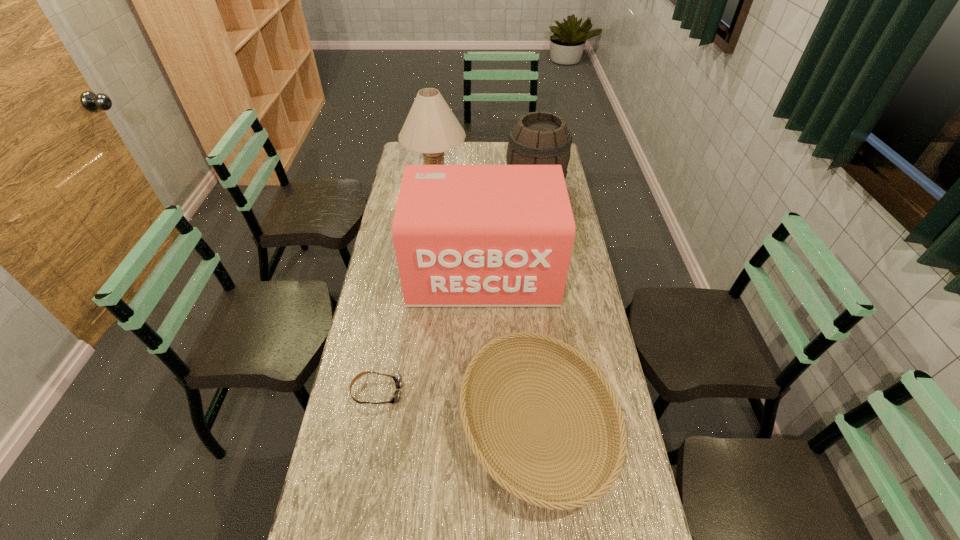
Where is `lampshade present at the left edge`? The width and height of the screenshot is (960, 540). lampshade present at the left edge is located at coordinates (431, 128).

Locate an element on the screen. The image size is (960, 540). box at the left edge is located at coordinates (464, 235).

Identify the location of goggles situated at the left edge. The height and width of the screenshot is (540, 960). (397, 379).

Where is `box positioned at the right edge`? Image resolution: width=960 pixels, height=540 pixels. box positioned at the right edge is located at coordinates (464, 235).

This screenshot has width=960, height=540. I want to click on wine bucket present at the right edge, so click(x=539, y=138).

Locate an element on the screen. The width and height of the screenshot is (960, 540). basket at the right edge is located at coordinates (617, 433).

In the image, there is a desktop. Identify the location of free space at the far edge. (461, 155).

In the image, there is a desktop. In order to click on vacant space at the left edge in this screenshot , I will do `click(398, 293)`.

Identify the location of free space at the right edge. This screenshot has width=960, height=540. (592, 294).

The width and height of the screenshot is (960, 540). Identify the location of vacant space at the far left corner. (415, 163).